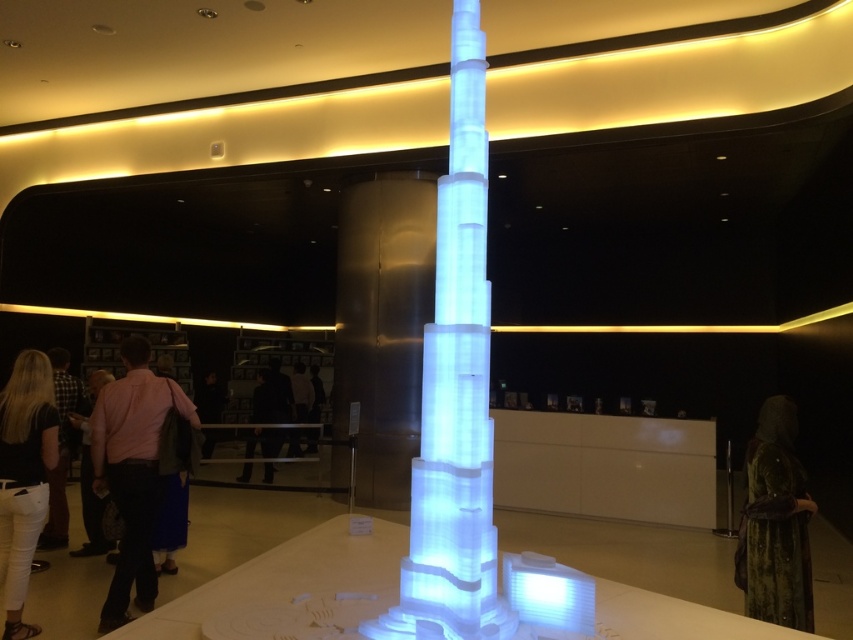
Does icy white plastic tower at center appear on the right side of pink shirt at left?

Correct, you'll find icy white plastic tower at center to the right of pink shirt at left.

Is icy white plastic tower at center below pink shirt at left?

Incorrect, icy white plastic tower at center is not positioned below pink shirt at left.

At what (x,y) coordinates should I click in order to perform the action: click on icy white plastic tower at center. Please return your answer as a coordinate pair (x, y). The height and width of the screenshot is (640, 853). Looking at the image, I should click on (454, 392).

Is point (486, 509) farther from viewer compared to point (792, 564)?

No, (486, 509) is closer to viewer.

Is icy white plastic tower at center further to camera compared to velvet green dress at lower right?

No, icy white plastic tower at center is in front of velvet green dress at lower right.

Who is more forward, (463, 362) or (799, 493)?

Positioned in front is point (463, 362).

At what (x,y) coordinates should I click in order to perform the action: click on icy white plastic tower at center. Please return your answer as a coordinate pair (x, y). Looking at the image, I should click on (454, 392).

Is pink fabric shirt at center wider than dark matte suit at center?

No, pink fabric shirt at center is not wider than dark matte suit at center.

Is pink fabric shirt at center taller than dark matte suit at center?

Indeed, pink fabric shirt at center has a greater height compared to dark matte suit at center.

Does point (142, 595) come in front of point (258, 374)?

Yes, it is in front of point (258, 374).

Locate an element on the screen. This screenshot has height=640, width=853. pink fabric shirt at center is located at coordinates (132, 472).